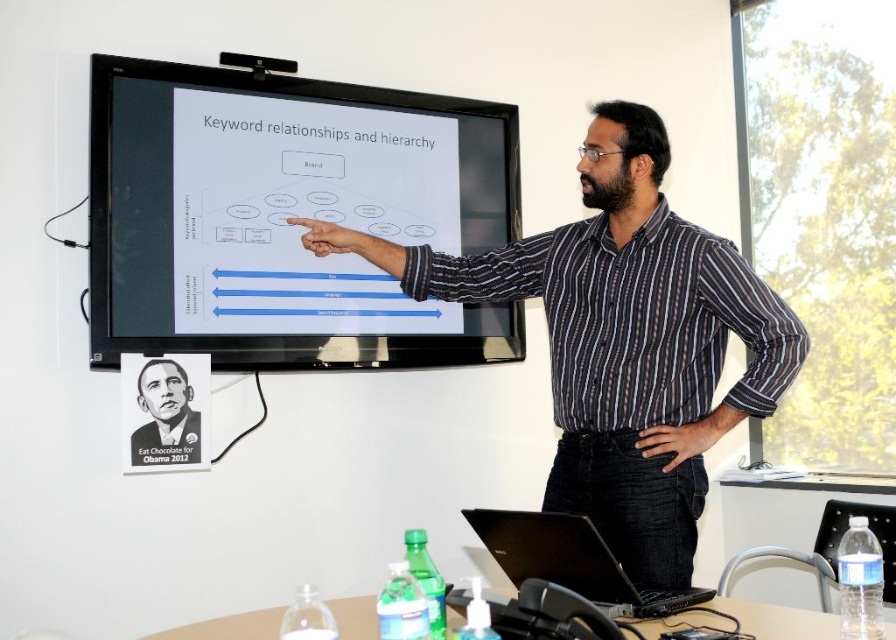
Question: Does matte black screen at upper center have a lesser width compared to black striped shirt at center?

Choices:
 (A) yes
 (B) no

Answer: (A)

Question: Estimate the real-world distances between objects in this image. Which object is farther from the matte black screen at upper center?

Choices:
 (A) black paper poster at upper left
 (B) black matte laptop at center

Answer: (B)

Question: Does black matte laptop at center have a lesser width compared to black paper poster at upper left?

Choices:
 (A) no
 (B) yes

Answer: (A)

Question: Where is black striped shirt at center located in relation to black paper poster at upper left in the image?

Choices:
 (A) left
 (B) right

Answer: (B)

Question: Which point is farther from the camera taking this photo?

Choices:
 (A) (587, 554)
 (B) (720, 346)
 (C) (187, 385)

Answer: (C)

Question: Which object is positioned farthest from the black striped shirt at center?

Choices:
 (A) black matte laptop at center
 (B) matte black screen at upper center

Answer: (B)